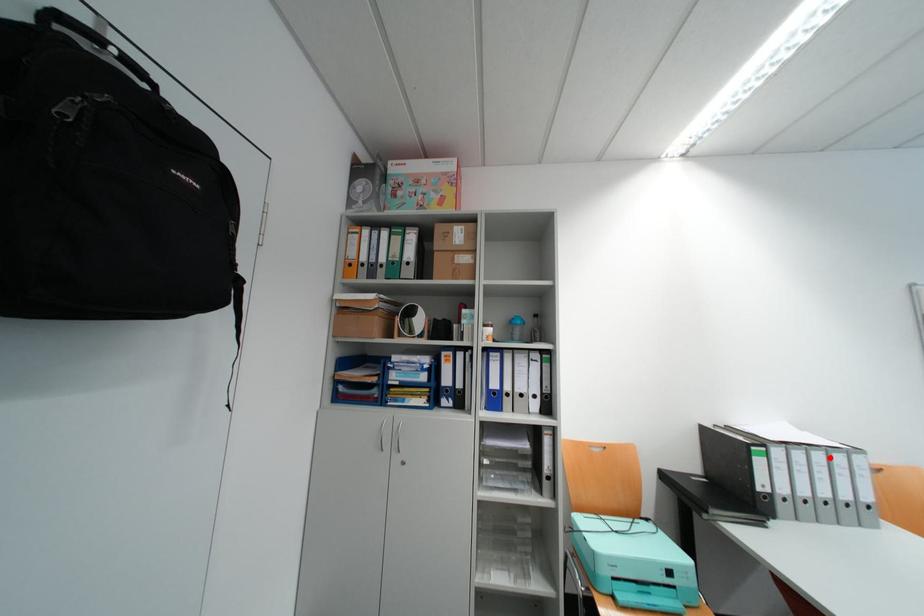
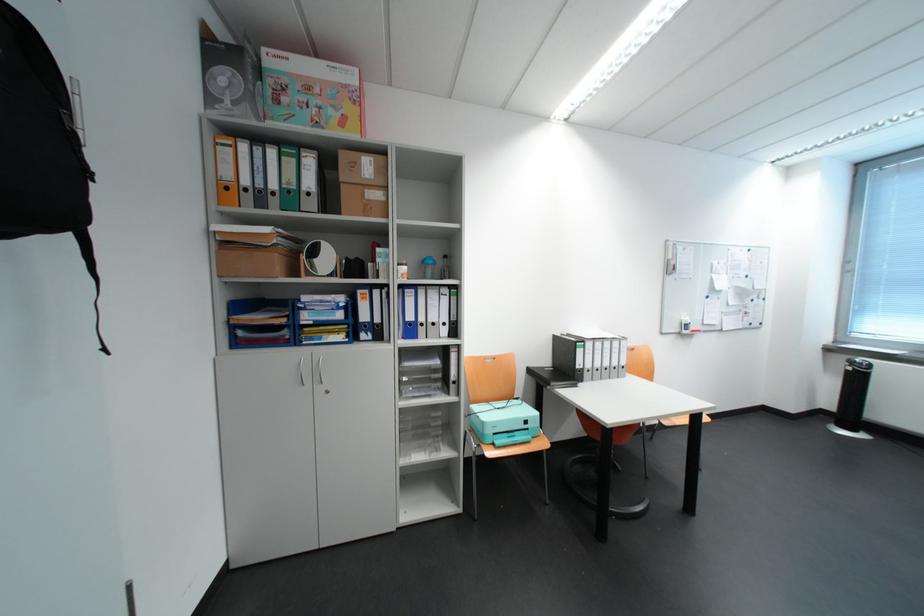
The point at the highlighted location is marked in the first image. Where is the corresponding point in the second image?

(618, 345)